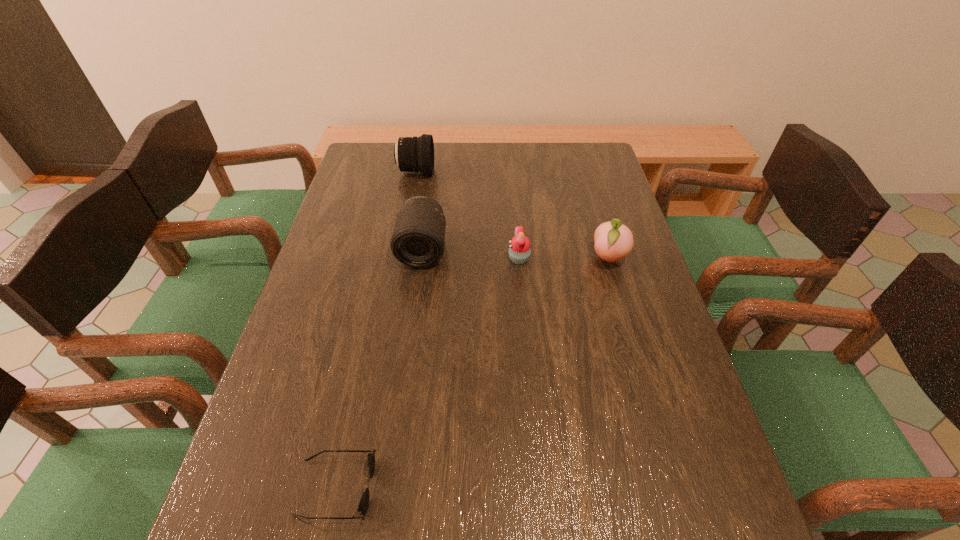
Locate an element on the screen. the nearer telephoto lens is located at coordinates (418, 239).

At what (x,y) coordinates should I click in order to perform the action: click on the farthest object. Please return your answer as a coordinate pair (x, y). The width and height of the screenshot is (960, 540). Looking at the image, I should click on tap(416, 154).

Find the location of a particular element. The height and width of the screenshot is (540, 960). peach is located at coordinates (613, 241).

The image size is (960, 540). Find the location of `the second object from right to left`. the second object from right to left is located at coordinates (519, 251).

At what (x,y) coordinates should I click in order to perform the action: click on cupcake. Please return your answer as a coordinate pair (x, y). Looking at the image, I should click on (519, 251).

At what (x,y) coordinates should I click in order to perform the action: click on the shortest object. Please return your answer as a coordinate pair (x, y). This screenshot has width=960, height=540. Looking at the image, I should click on (364, 502).

You are a GUI agent. You are given a task and a screenshot of the screen. Output one action in this format:
    pyautogui.click(x=<x>, y=<y>)
    Task: Click on the sunglasses
    
    Given the screenshot: What is the action you would take?
    pyautogui.click(x=364, y=502)

Find the location of a particular element. This screenshot has width=960, height=540. vacant position located 0.330m on the surface of the nearer telephoto lens is located at coordinates (405, 378).

At what (x,y) coordinates should I click in order to perform the action: click on vacant space located 0.340m at the front element of the farther telephoto lens. Please return your answer as a coordinate pair (x, y). The width and height of the screenshot is (960, 540). Looking at the image, I should click on (533, 172).

Find the location of a particular element. The height and width of the screenshot is (540, 960). free space located on the left of the peach is located at coordinates (481, 258).